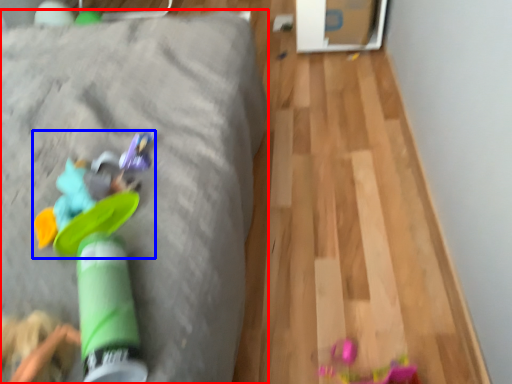
Question: Which point is closer to the camera, furniture (highlighted by a red box) or toy (highlighted by a blue box)?

Choices:
 (A) furniture
 (B) toy

Answer: (B)